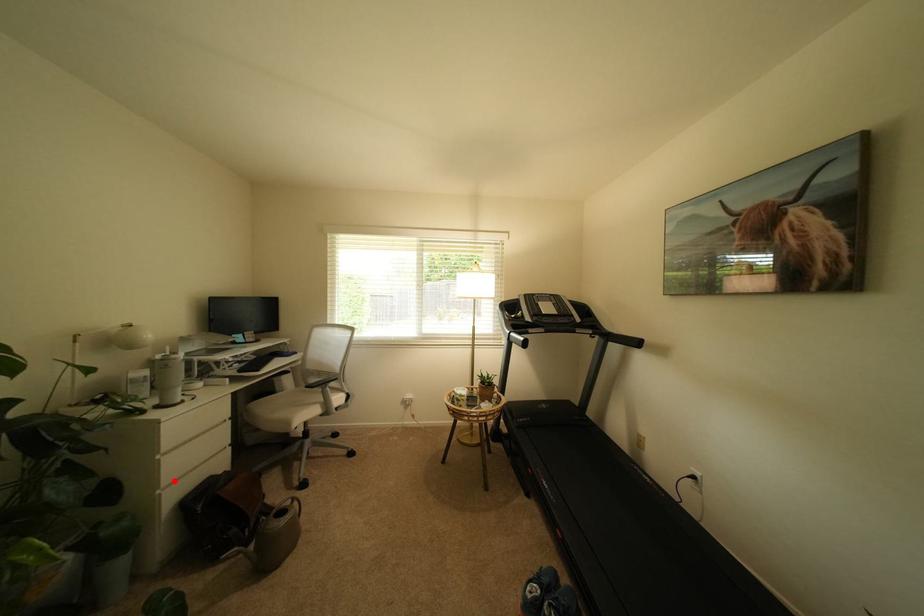
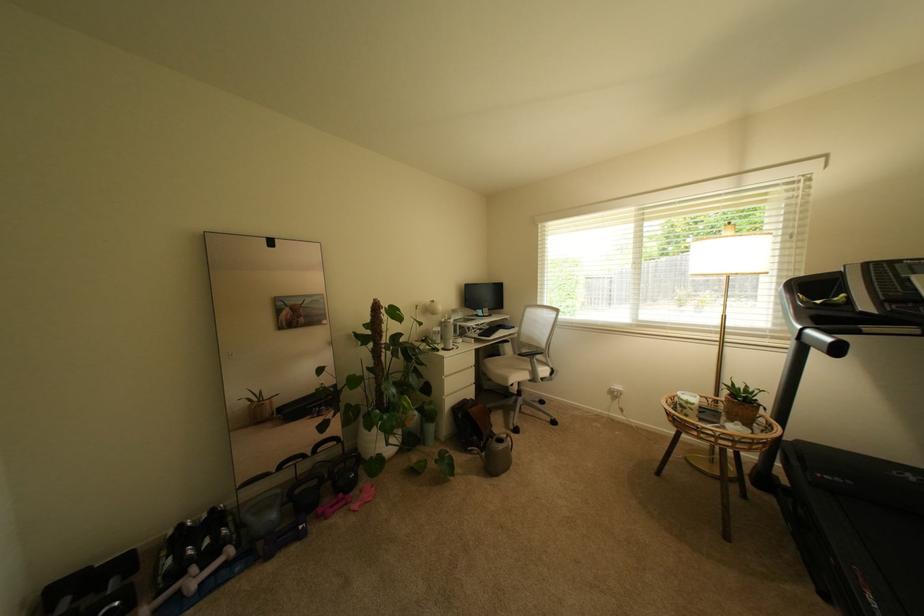
Question: I am providing you with two images of the same scene from different viewpoints. A red point is shown in image1. For the corresponding object point in image2, is it positioned nearer or farther from the camera?

Choices:
 (A) Nearer
 (B) Farther

Answer: (B)